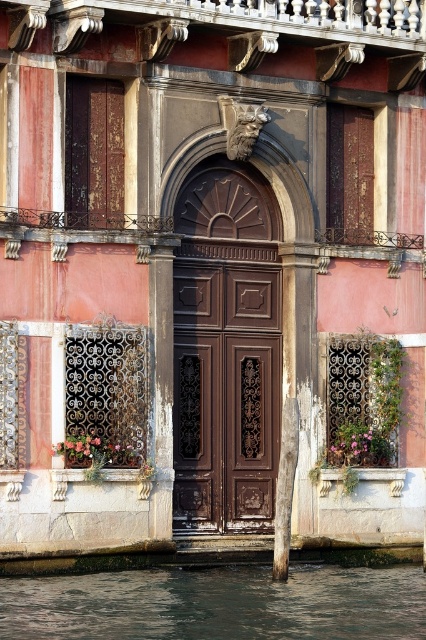
Question: Which of the following is the farthest from the observer?

Choices:
 (A) dark wood paneling at center
 (B) dark green water at lower left

Answer: (A)

Question: Is dark wood paneling at center thinner than dark green water at lower left?

Choices:
 (A) no
 (B) yes

Answer: (B)

Question: Is dark wood paneling at center positioned behind dark green water at lower left?

Choices:
 (A) no
 (B) yes

Answer: (B)

Question: Can you confirm if dark wood paneling at center is wider than dark green water at lower left?

Choices:
 (A) no
 (B) yes

Answer: (A)

Question: Which point is farther from the camera taking this photo?

Choices:
 (A) (212, 420)
 (B) (265, 612)

Answer: (A)